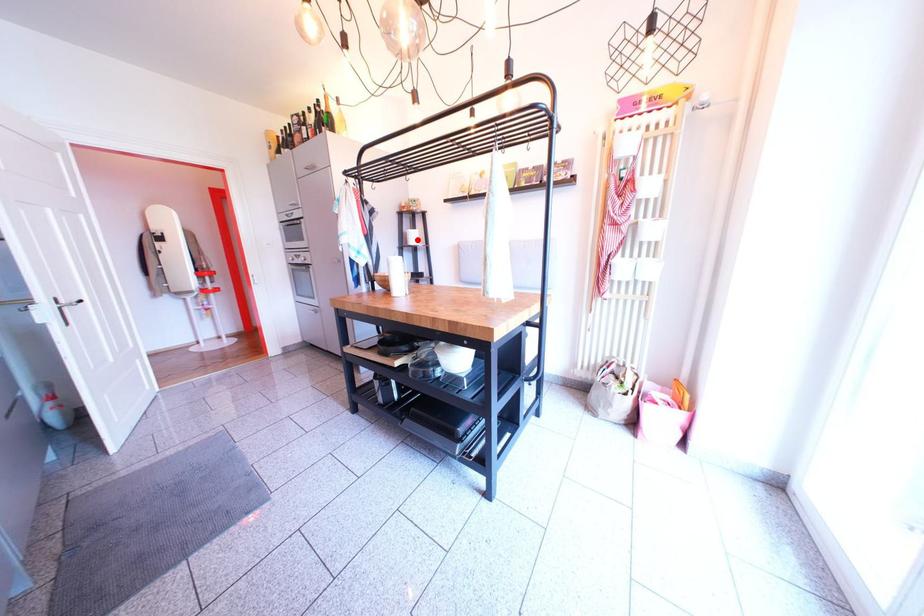
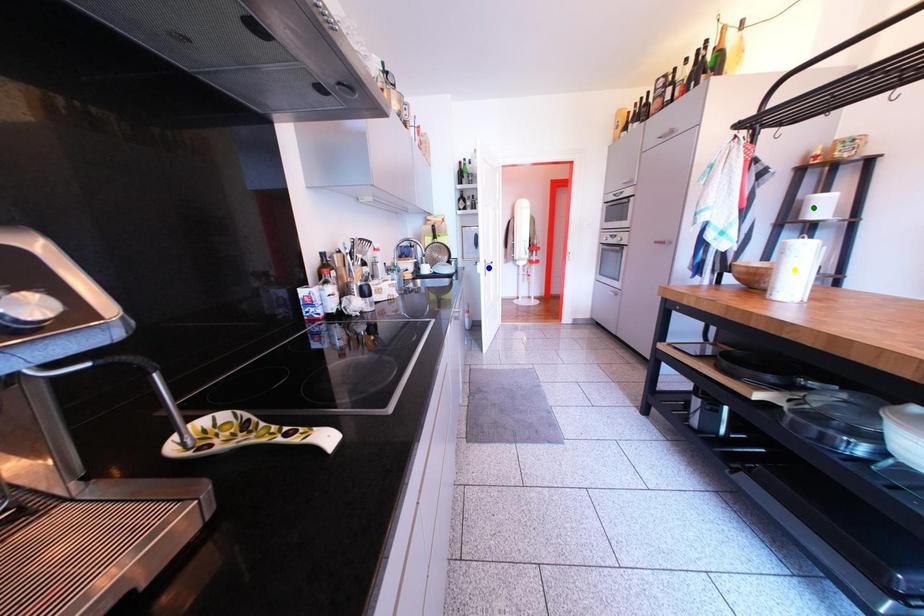
Question: I am providing you with two images of the same scene from different viewpoints. A red point is marked on the first image. You are given multiple points on the second image. Which spot in image 2 lines up with the point in image 1?

Choices:
 (A) blue point
 (B) yellow point
 (C) green point

Answer: (C)